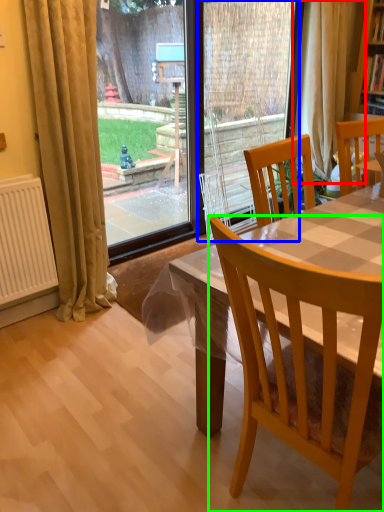
Question: Considering the real-world distances, which object is farthest from curtain (highlighted by a red box)? screen door (highlighted by a blue box) or chair (highlighted by a green box)?

Choices:
 (A) screen door
 (B) chair

Answer: (B)